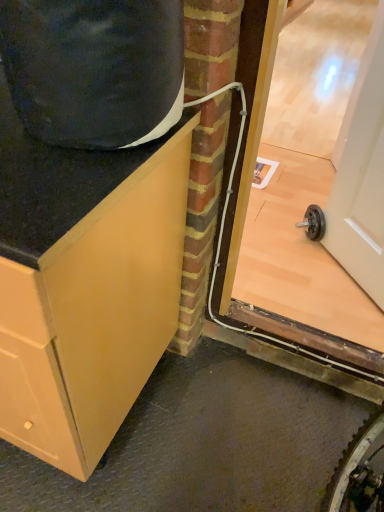
Question: From a real-world perspective, is matte wood cabinet at left physically above transparent glass door at right?

Choices:
 (A) no
 (B) yes

Answer: (A)

Question: Is matte wood cabinet at left thinner than transparent glass door at right?

Choices:
 (A) no
 (B) yes

Answer: (A)

Question: Does matte wood cabinet at left have a larger size compared to transparent glass door at right?

Choices:
 (A) yes
 (B) no

Answer: (A)

Question: Considering the relative positions of matte wood cabinet at left and transparent glass door at right in the image provided, is matte wood cabinet at left to the right of transparent glass door at right from the viewer's perspective?

Choices:
 (A) yes
 (B) no

Answer: (B)

Question: From the image's perspective, is matte wood cabinet at left over transparent glass door at right?

Choices:
 (A) yes
 (B) no

Answer: (B)

Question: Is matte wood cabinet at left smaller than transparent glass door at right?

Choices:
 (A) no
 (B) yes

Answer: (A)

Question: Is matte wood cabinet at left at the right side of white glossy door at upper right?

Choices:
 (A) no
 (B) yes

Answer: (A)

Question: From the image's perspective, is matte wood cabinet at left located beneath white glossy door at upper right?

Choices:
 (A) no
 (B) yes

Answer: (B)

Question: Can you confirm if matte wood cabinet at left is shorter than white glossy door at upper right?

Choices:
 (A) yes
 (B) no

Answer: (B)

Question: Does matte wood cabinet at left have a lesser width compared to white glossy door at upper right?

Choices:
 (A) no
 (B) yes

Answer: (A)

Question: From a real-world perspective, is matte wood cabinet at left positioned over white glossy door at upper right based on gravity?

Choices:
 (A) yes
 (B) no

Answer: (B)

Question: Is matte wood cabinet at left smaller than white glossy door at upper right?

Choices:
 (A) yes
 (B) no

Answer: (B)

Question: Is transparent glass door at right smaller than white glossy door at upper right?

Choices:
 (A) no
 (B) yes

Answer: (A)